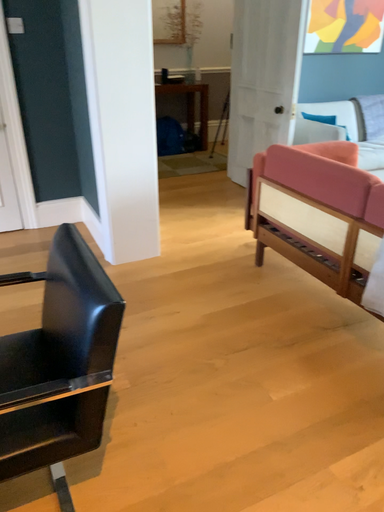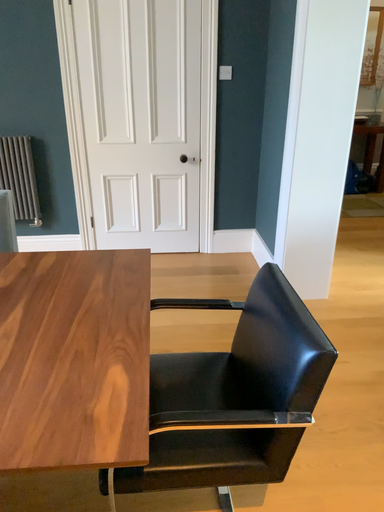
Question: Which way did the camera rotate in the video?

Choices:
 (A) rotated right
 (B) rotated left

Answer: (B)